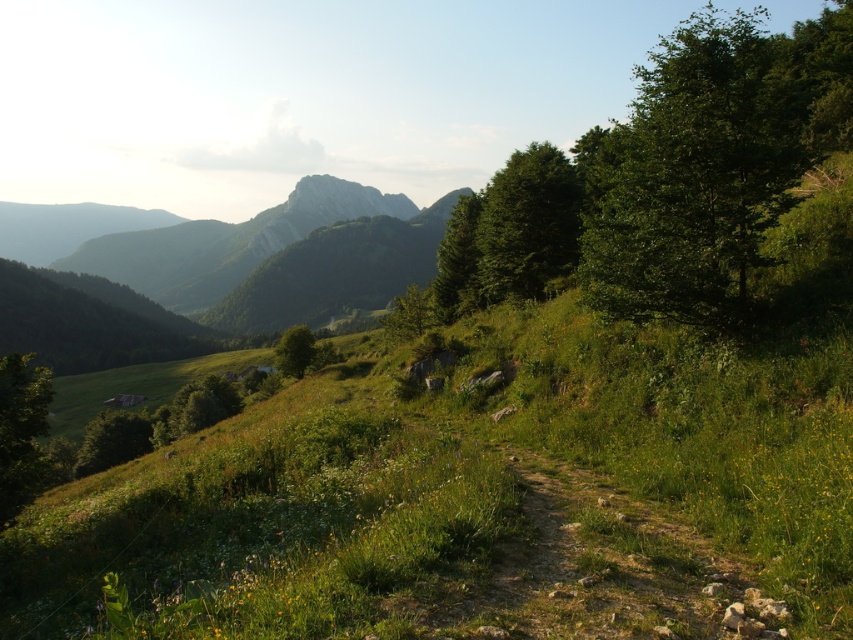
You are standing at the center of the dirt path in the image. Looking towards the lower left corner of the image, can you see the green grassy at lower left? Please explain your answer based on the coordinates provided.

Yes, the green grassy at lower left is located at coordinates point (468, 497), which is within the lower left area of the image, so it should be visible from the center of the dirt path.

You are planning a picnic and want to choose between the green leafy tree at right and the green leafy tree at center for shade. Which tree would provide a larger shaded area based on their widths?

The green leafy tree at right has a greater width than the green leafy tree at center, so it would provide a larger shaded area.

From the picture: You are standing at the point closer to the camera in the image. Which point are you at, point (689, 157) or point (288, 337)?

You are at point (689, 157) because it is closer to the camera than point (288, 337).